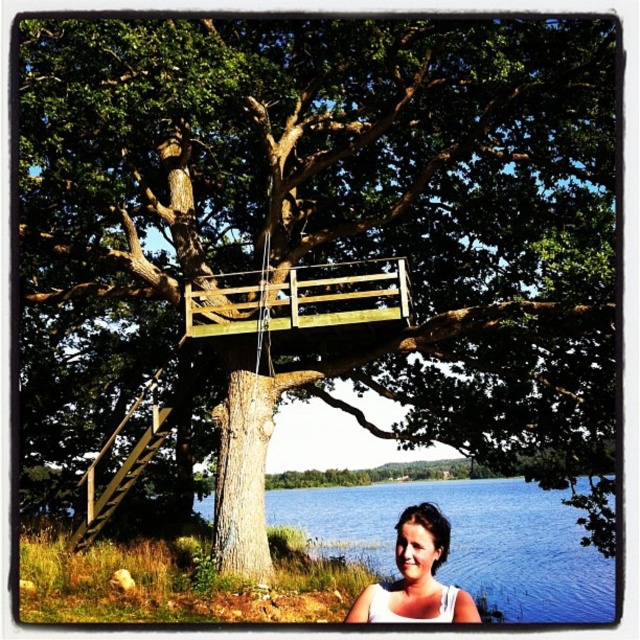
Question: Which is farther from the wooden at upper center?

Choices:
 (A) white fabric at lower center
 (B) wooden at left
 (C) blue water at lower center

Answer: (C)

Question: Which of the following is the closest to the observer?

Choices:
 (A) (221, 317)
 (B) (371, 588)
 (C) (116, 481)

Answer: (B)

Question: Considering the real-world distances, which object is farthest from the white fabric at lower center?

Choices:
 (A) blue water at lower center
 (B) wooden at left

Answer: (B)

Question: Can you confirm if blue water at lower center is thinner than wooden at upper center?

Choices:
 (A) no
 (B) yes

Answer: (A)

Question: Is blue water at lower center thinner than white fabric at lower center?

Choices:
 (A) no
 (B) yes

Answer: (A)

Question: Does blue water at lower center have a greater width compared to wooden at upper center?

Choices:
 (A) no
 (B) yes

Answer: (B)